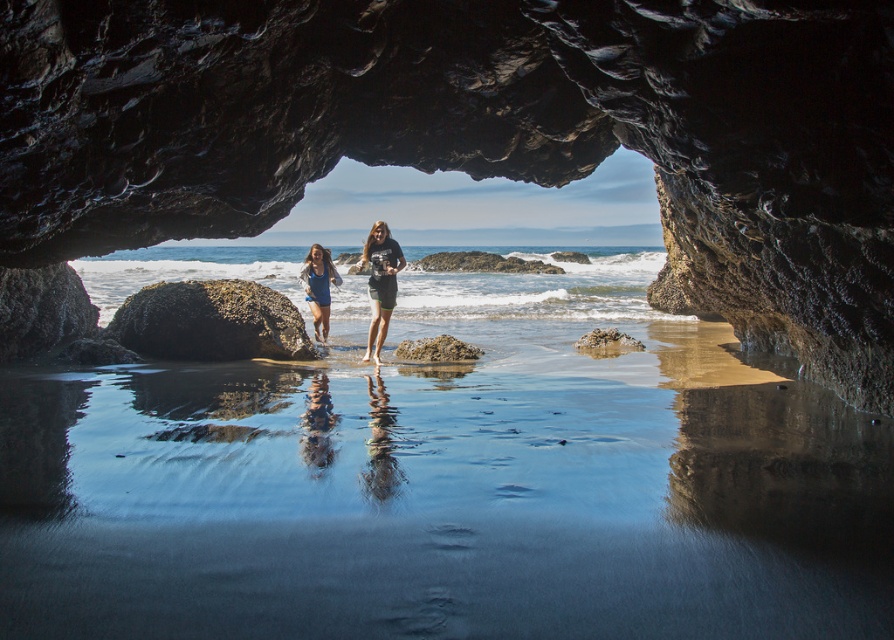
Question: From the image, what is the correct spatial relationship of sandy brown rock at center in relation to smooth sandstone rock at center?

Choices:
 (A) above
 (B) below

Answer: (B)

Question: Which is nearer to the smooth sandstone rock at center?

Choices:
 (A) matte blue dress at center
 (B) matte black t-shirt at center
 (C) smooth dark rock at center

Answer: (B)

Question: Does rusty metallic rock at center have a larger size compared to matte blue dress at center?

Choices:
 (A) yes
 (B) no

Answer: (A)

Question: Can you confirm if matte black t-shirt at center is thinner than matte blue dress at center?

Choices:
 (A) no
 (B) yes

Answer: (B)

Question: Which point is closer to the camera?

Choices:
 (A) smooth dark rock at center
 (B) matte blue dress at center
 (C) sandy brown rock at center
 (D) smooth sandstone rock at center

Answer: (A)

Question: Which of these objects is positioned farthest from the matte black t-shirt at center?

Choices:
 (A) smooth sandstone rock at center
 (B) matte blue dress at center
 (C) rusty metallic rock at center
 (D) smooth dark rock at center

Answer: (A)